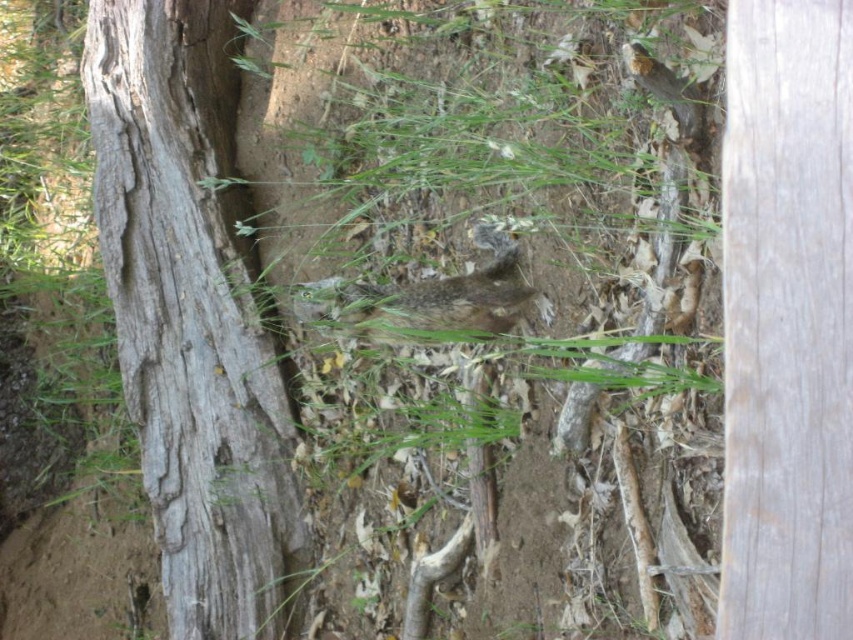
Is point (721, 612) positioned in front of point (326, 289)?

Yes.

Is point (762, 42) farther from viewer compared to point (440, 320)?

No, it is not.

Where is `weathered wood at right`? weathered wood at right is located at coordinates (787, 321).

Which is behind, point (196, 97) or point (387, 307)?

Positioned behind is point (196, 97).

Does point (165, 560) lie in front of point (497, 253)?

No, (165, 560) is behind (497, 253).

You are a GUI agent. You are given a task and a screenshot of the screen. Output one action in this format:
    pyautogui.click(x=<x>, y=<y>)
    Task: Click on the gray rough bark tree trunk at left
    The image size is (853, 640).
    Given the screenshot: What is the action you would take?
    pyautogui.click(x=193, y=314)

How much distance is there between gray rough bark tree trunk at left and weathered wood at right?

They are 1.93 meters apart.

Can you confirm if gray rough bark tree trunk at left is taller than weathered wood at right?

Yes, gray rough bark tree trunk at left is taller than weathered wood at right.

Find the location of a particular element. The image size is (853, 640). gray rough bark tree trunk at left is located at coordinates (193, 314).